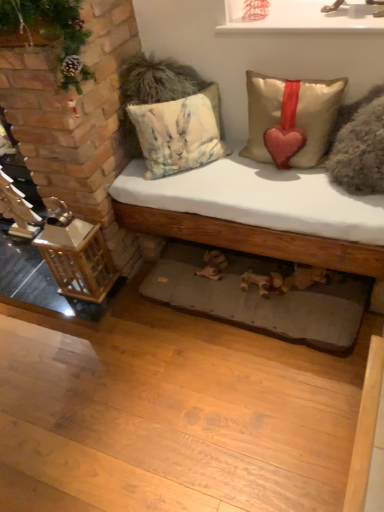
Locate an element on the screen. The width and height of the screenshot is (384, 512). vacant space positioned to the left of satin gold pillow with red heart at upper center, the second pillow from the right is located at coordinates (221, 183).